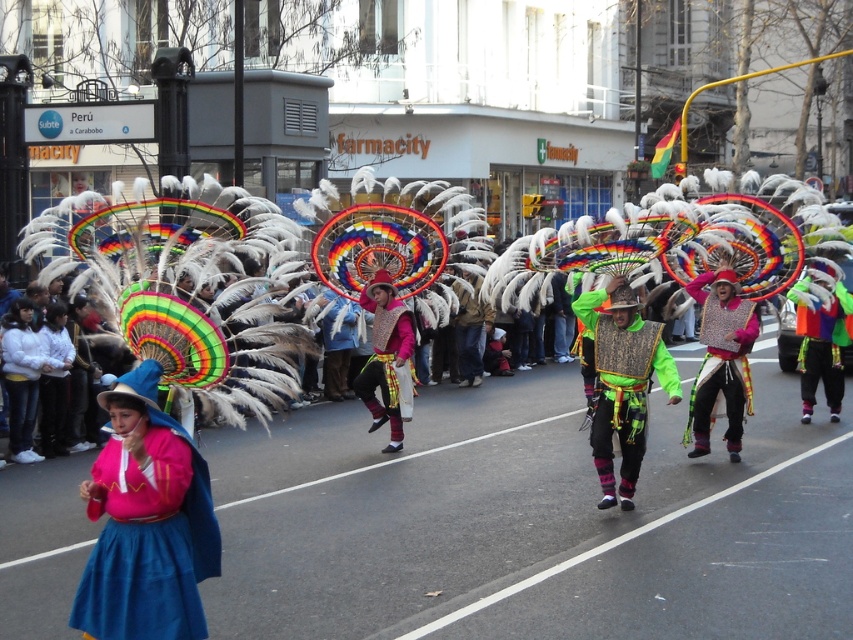
Question: Which of the following is the farthest from the observer?

Choices:
 (A) matte pink fabric at center
 (B) matte pink sweater at center
 (C) green textured vest at center
 (D) multicolored fabric costume at center

Answer: (A)

Question: Is matte pink sweater at center wider than multicolored fabric costume at center?

Choices:
 (A) yes
 (B) no

Answer: (B)

Question: From the image, what is the correct spatial relationship of matte pink sweater at center in relation to green textured vest at center?

Choices:
 (A) below
 (B) above

Answer: (A)

Question: Which of the following is the farthest from the observer?

Choices:
 (A) multicolored fabric costume at center
 (B) metallic sequined vest at center
 (C) matte pink sweater at center

Answer: (A)

Question: Which point is closer to the camera?

Choices:
 (A) multicolored fabric costume at center
 (B) green textured vest at center
 (C) matte pink sweater at center

Answer: (C)

Question: In this image, where is matte pink sweater at center located relative to green textured vest at center?

Choices:
 (A) right
 (B) left

Answer: (B)